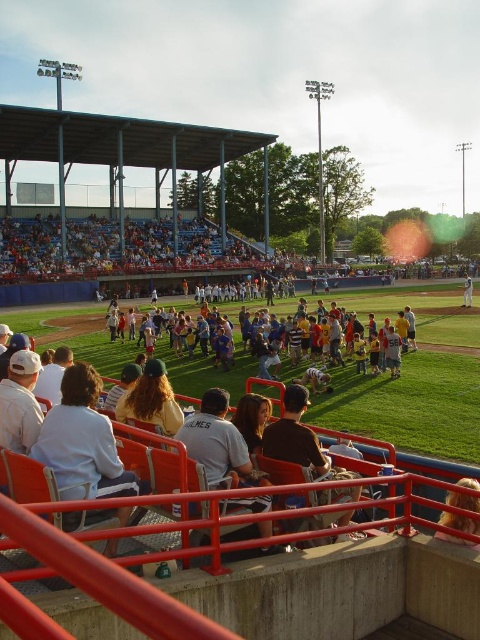
How distant is light brown leather jacket at center from light brown leather jacket at lower right?

light brown leather jacket at center and light brown leather jacket at lower right are 6.11 meters apart.

Does light brown leather jacket at center appear under light brown leather jacket at lower right?

Indeed, light brown leather jacket at center is positioned under light brown leather jacket at lower right.

Measure the distance between light brown leather jacket at center and camera.

The distance of light brown leather jacket at center from camera is 61.25 feet.

The height and width of the screenshot is (640, 480). What are the coordinates of `light brown leather jacket at center` in the screenshot? It's located at (217, 442).

Which of these two, light blue shirt at lower left or white jersey at center, stands taller?

white jersey at center is taller.

Is light blue shirt at lower left wider than white jersey at center?

In fact, light blue shirt at lower left might be narrower than white jersey at center.

What do you see at coordinates (82, 440) in the screenshot? The width and height of the screenshot is (480, 640). I see `light blue shirt at lower left` at bounding box center [82, 440].

Where is `light blue shirt at lower left`? The width and height of the screenshot is (480, 640). light blue shirt at lower left is located at coordinates (82, 440).

Who is shorter, light blue shirt at lower left or light brown leather jacket at center?

With less height is light brown leather jacket at center.

Does point (68, 492) come behind point (259, 525)?

Yes.

Which is behind, point (76, 452) or point (216, 429)?

The point (216, 429) is behind.

Find the location of `light blue shirt at lower left`. light blue shirt at lower left is located at coordinates (82, 440).